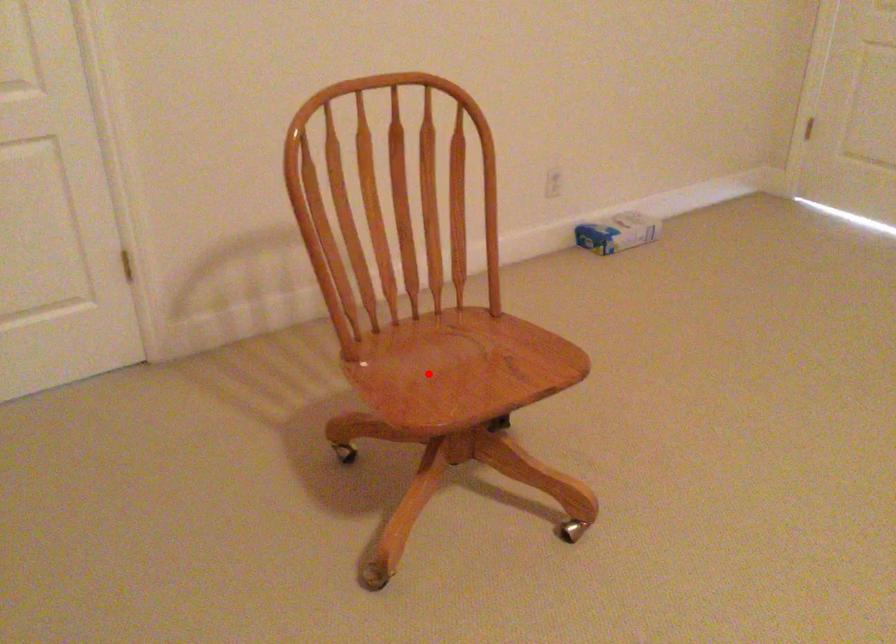
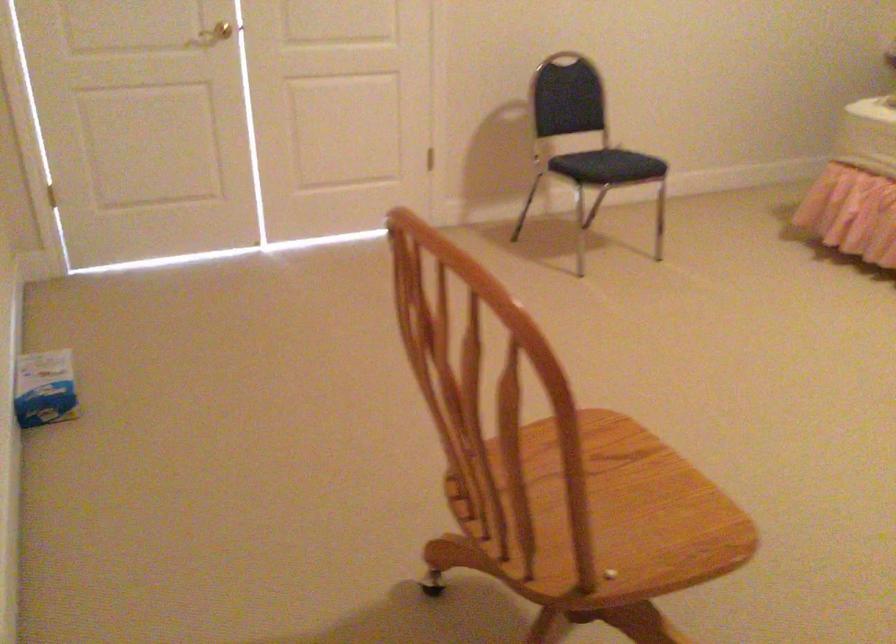
Question: I am providing you with two images of the same scene from different viewpoints. A red point is marked on the first image. At the location where the point appears in image 1, is it still visible in image 2?

Choices:
 (A) Yes
 (B) No

Answer: (B)